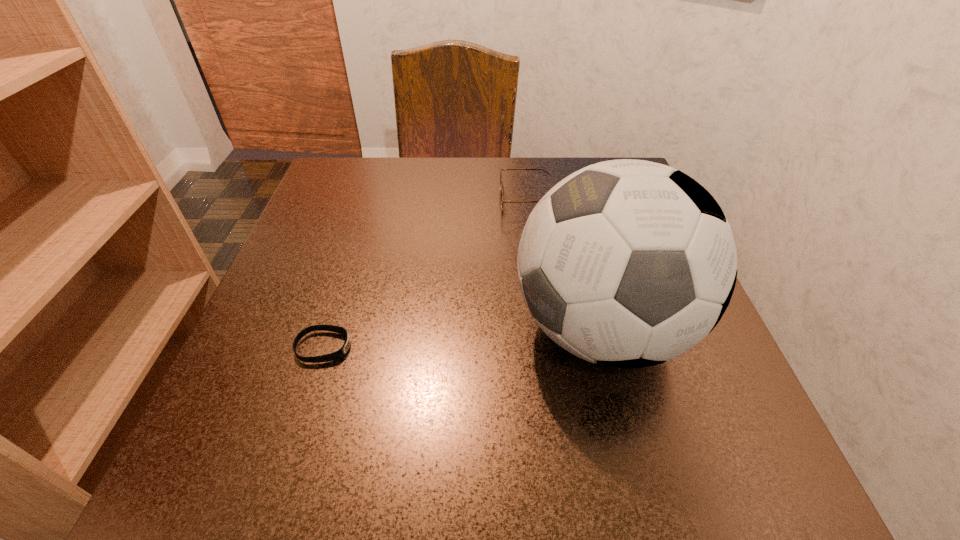
The height and width of the screenshot is (540, 960). I want to click on vacant space located at the front view of the second tallest object, so click(456, 200).

Identify the location of vacant area located on the display of the wristband. (427, 347).

Where is `object that is positioned at the far edge`? This screenshot has height=540, width=960. object that is positioned at the far edge is located at coordinates (501, 169).

I want to click on object at the left edge, so click(341, 352).

Find the location of a particular element. object present at the right edge is located at coordinates (627, 263).

Where is `vacant space at the far edge of the desktop`? The width and height of the screenshot is (960, 540). vacant space at the far edge of the desktop is located at coordinates (429, 184).

Locate an element on the screen. free region at the near edge is located at coordinates (443, 433).

Where is `free space at the left edge`? The image size is (960, 540). free space at the left edge is located at coordinates (282, 293).

I want to click on vacant space at the right edge of the desktop, so click(629, 409).

In the image, there is a desktop. Find the location of `vacant space at the far left corner`. vacant space at the far left corner is located at coordinates (361, 173).